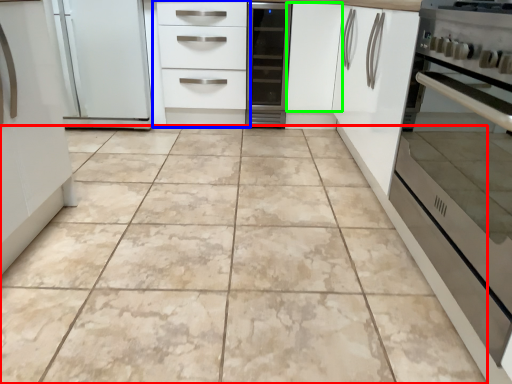
Question: Which object is the closest to the ceramic tile (highlighted by a red box)? Choose among these: chest of drawers (highlighted by a blue box) or cabinetry (highlighted by a green box).

Choices:
 (A) chest of drawers
 (B) cabinetry

Answer: (A)